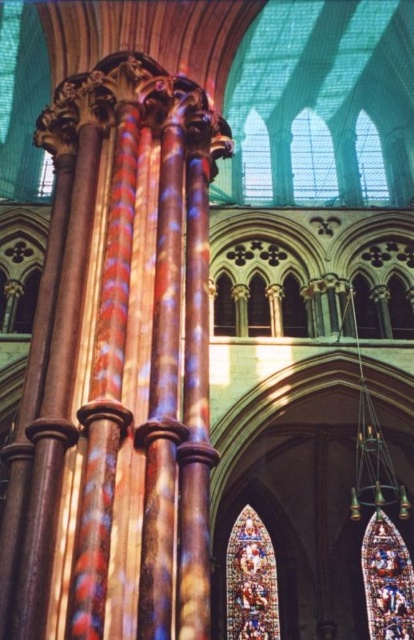
Does stained glass window at center lie behind multicolored stained glass at lower right?

No, stained glass window at center is in front of multicolored stained glass at lower right.

Between stained glass window at center and multicolored stained glass at lower right, which one has less height?

Standing shorter between the two is stained glass window at center.

Which is behind, point (235, 628) or point (389, 552)?

The point (389, 552) is more distant.

I want to click on stained glass window at center, so click(x=250, y=580).

Between stained glass window at upper left and multicolored stained glass at lower right, which one is positioned higher?

Positioned higher is stained glass window at upper left.

Is stained glass window at upper left below multicolored stained glass at lower right?

Actually, stained glass window at upper left is above multicolored stained glass at lower right.

At what (x,y) coordinates should I click in order to perform the action: click on stained glass window at upper left. Please return your answer as a coordinate pair (x, y). The image size is (414, 640). Looking at the image, I should click on (21, 97).

This screenshot has height=640, width=414. Find the location of `stained glass window at upper left`. stained glass window at upper left is located at coordinates (21, 97).

Which is behind, point (336, 108) or point (235, 525)?

The point (336, 108) is behind.

Can you confirm if stained glass window at upper center is wider than stained glass window at center?

Correct, the width of stained glass window at upper center exceeds that of stained glass window at center.

Is point (226, 109) farther from camera compared to point (250, 628)?

Yes.

The image size is (414, 640). In order to click on stained glass window at upper center in this screenshot , I will do `click(322, 106)`.